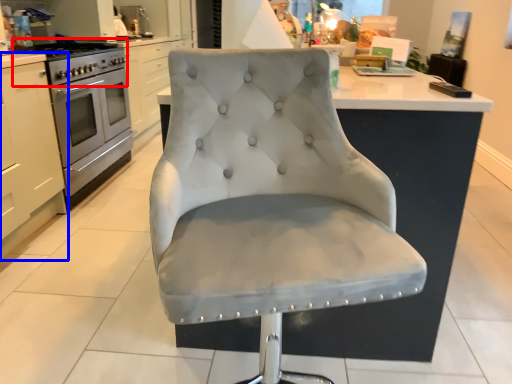
Question: Among these objects, which one is farthest to the camera, gas stove (highlighted by a red box) or cabinetry (highlighted by a blue box)?

Choices:
 (A) gas stove
 (B) cabinetry

Answer: (A)